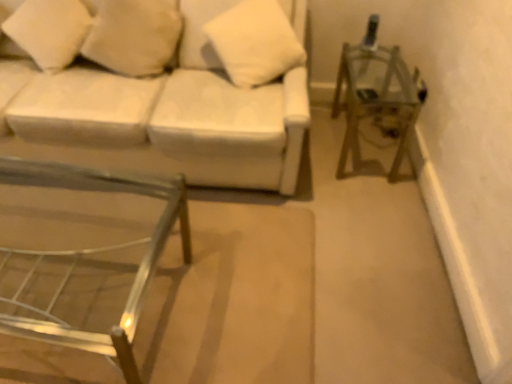
Question: From a real-world perspective, is white soft pillow at upper left, marked as the 3th pillow in a right-to-left arrangement, physically below white soft pillow at upper center, arranged as the 1th pillow when viewed from the right?

Choices:
 (A) no
 (B) yes

Answer: (B)

Question: Is white soft pillow at upper center, which is the 3th pillow in left-to-right order, completely or partially inside white soft pillow at upper left, marked as the 3th pillow in a right-to-left arrangement?

Choices:
 (A) no
 (B) yes

Answer: (A)

Question: From the image's perspective, would you say white soft pillow at upper left, acting as the first pillow starting from the left, is shown under white soft pillow at upper center, arranged as the 1th pillow when viewed from the right?

Choices:
 (A) no
 (B) yes

Answer: (A)

Question: Does white soft pillow at upper left, acting as the first pillow starting from the left, have a smaller size compared to white soft pillow at upper center, arranged as the 1th pillow when viewed from the right?

Choices:
 (A) no
 (B) yes

Answer: (B)

Question: Does white soft pillow at upper left, acting as the first pillow starting from the left, appear on the left side of white soft pillow at upper center, which is the 3th pillow in left-to-right order?

Choices:
 (A) no
 (B) yes

Answer: (B)

Question: From the image's perspective, does white soft pillow at upper left, marked as the 3th pillow in a right-to-left arrangement, appear higher than white soft pillow at upper center, which is the 3th pillow in left-to-right order?

Choices:
 (A) no
 (B) yes

Answer: (B)

Question: Is white soft pillow at upper left, arranged as the second pillow when viewed from the left, facing away from metallic silver table at lower left?

Choices:
 (A) yes
 (B) no

Answer: (B)

Question: Is white soft pillow at upper left, the second pillow viewed from the right, at the left side of metallic silver table at lower left?

Choices:
 (A) yes
 (B) no

Answer: (B)

Question: From a real-world perspective, is white soft pillow at upper left, the second pillow viewed from the right, beneath metallic silver table at lower left?

Choices:
 (A) no
 (B) yes

Answer: (A)

Question: From the image's perspective, is white soft pillow at upper left, the second pillow viewed from the right, below metallic silver table at lower left?

Choices:
 (A) yes
 (B) no

Answer: (B)

Question: Can you confirm if white soft pillow at upper left, arranged as the second pillow when viewed from the left, is wider than metallic silver table at lower left?

Choices:
 (A) no
 (B) yes

Answer: (A)

Question: From a real-world perspective, is white soft pillow at upper left, the second pillow viewed from the right, physically above metallic silver table at lower left?

Choices:
 (A) yes
 (B) no

Answer: (A)

Question: From a real-world perspective, is white soft pillow at upper left, acting as the first pillow starting from the left, under white fabric couch at upper left?

Choices:
 (A) yes
 (B) no

Answer: (B)